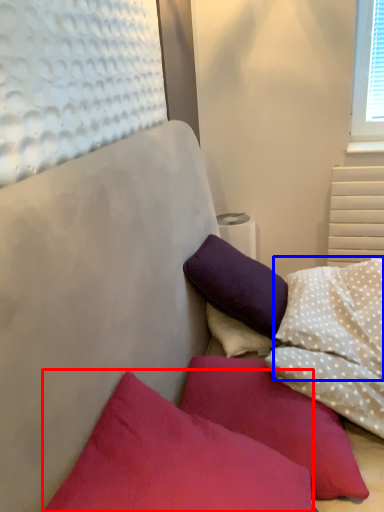
Question: Which object appears closest to the camera in this image, pillow (highlighted by a red box) or pillow (highlighted by a blue box)?

Choices:
 (A) pillow
 (B) pillow

Answer: (A)